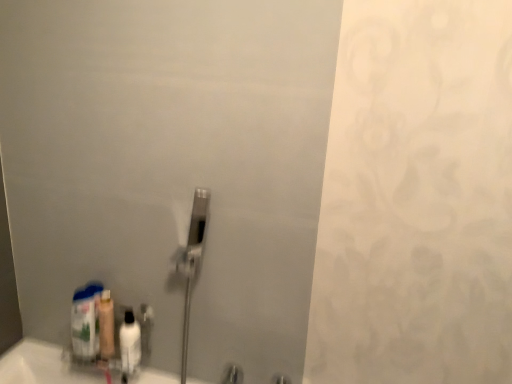
Question: Can you confirm if white glossy bottle at lower left, which is the first mouthwash from right to left, is wider than translucent plastic bottle at lower left?

Choices:
 (A) no
 (B) yes

Answer: (A)

Question: Is white glossy bottle at lower left, which is the first mouthwash from right to left, closer to camera compared to translucent plastic bottle at lower left?

Choices:
 (A) no
 (B) yes

Answer: (B)

Question: Does white glossy bottle at lower left, the 2th mouthwash in the left-to-right sequence, have a lesser width compared to translucent plastic bottle at lower left?

Choices:
 (A) yes
 (B) no

Answer: (A)

Question: From a real-world perspective, is white glossy bottle at lower left, the 2th mouthwash in the left-to-right sequence, physically below translucent plastic bottle at lower left?

Choices:
 (A) no
 (B) yes

Answer: (B)

Question: Would you say white glossy bottle at lower left, the 2th mouthwash in the left-to-right sequence, is outside translucent plastic bottle at lower left?

Choices:
 (A) yes
 (B) no

Answer: (A)

Question: Looking at their shapes, would you say white glossy bottle at lower left, the 2th mouthwash in the left-to-right sequence, is wider or thinner than translucent plastic mouthwash at lower left, the second mouthwash positioned from the right?

Choices:
 (A) wide
 (B) thin

Answer: (A)

Question: From the image's perspective, is white glossy bottle at lower left, the 2th mouthwash in the left-to-right sequence, positioned above or below translucent plastic mouthwash at lower left, the second mouthwash positioned from the right?

Choices:
 (A) below
 (B) above

Answer: (A)

Question: Is white glossy bottle at lower left, the 2th mouthwash in the left-to-right sequence, in front of or behind translucent plastic mouthwash at lower left, which is the 1th mouthwash in left-to-right order, in the image?

Choices:
 (A) front
 (B) behind

Answer: (A)

Question: From a real-world perspective, is white glossy bottle at lower left, the 2th mouthwash in the left-to-right sequence, physically located above or below translucent plastic mouthwash at lower left, which is the 1th mouthwash in left-to-right order?

Choices:
 (A) below
 (B) above

Answer: (A)

Question: Considering the positions of translucent plastic mouthwash at lower left, which is the 1th mouthwash in left-to-right order, and white glossy bottle at lower left, which is the first mouthwash from right to left, in the image, is translucent plastic mouthwash at lower left, which is the 1th mouthwash in left-to-right order, taller or shorter than white glossy bottle at lower left, which is the first mouthwash from right to left,?

Choices:
 (A) short
 (B) tall

Answer: (B)

Question: Do you think translucent plastic mouthwash at lower left, the second mouthwash positioned from the right, is within white glossy bottle at lower left, which is the first mouthwash from right to left, or outside of it?

Choices:
 (A) inside
 (B) outside

Answer: (B)

Question: From a real-world perspective, is translucent plastic mouthwash at lower left, which is the 1th mouthwash in left-to-right order, above or below white glossy bottle at lower left, the 2th mouthwash in the left-to-right sequence?

Choices:
 (A) above
 (B) below

Answer: (A)

Question: Is point (112, 331) closer or farther from the camera than point (130, 339)?

Choices:
 (A) farther
 (B) closer

Answer: (A)

Question: From the image's perspective, is white glossy bottle at lower left, the 2th mouthwash in the left-to-right sequence, positioned above or below translucent plastic bottle at lower left?

Choices:
 (A) below
 (B) above

Answer: (A)

Question: Looking at their shapes, would you say white glossy bottle at lower left, which is the first mouthwash from right to left, is wider or thinner than translucent plastic bottle at lower left?

Choices:
 (A) thin
 (B) wide

Answer: (A)